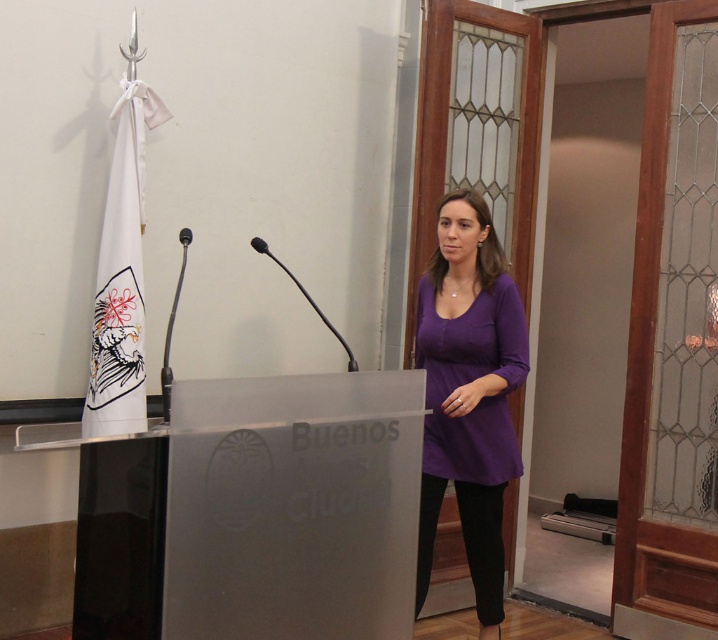
Question: Observing the image, what is the correct spatial positioning of clear acrylic podium at center in reference to purple soft fabric shirt at center?

Choices:
 (A) right
 (B) left

Answer: (B)

Question: Does clear acrylic podium at center come behind purple soft fabric shirt at center?

Choices:
 (A) no
 (B) yes

Answer: (A)

Question: Which point is closer to the camera?

Choices:
 (A) clear acrylic podium at center
 (B) purple soft fabric shirt at center

Answer: (A)

Question: Observing the image, what is the correct spatial positioning of clear acrylic podium at center in reference to purple soft fabric shirt at center?

Choices:
 (A) left
 (B) right

Answer: (A)